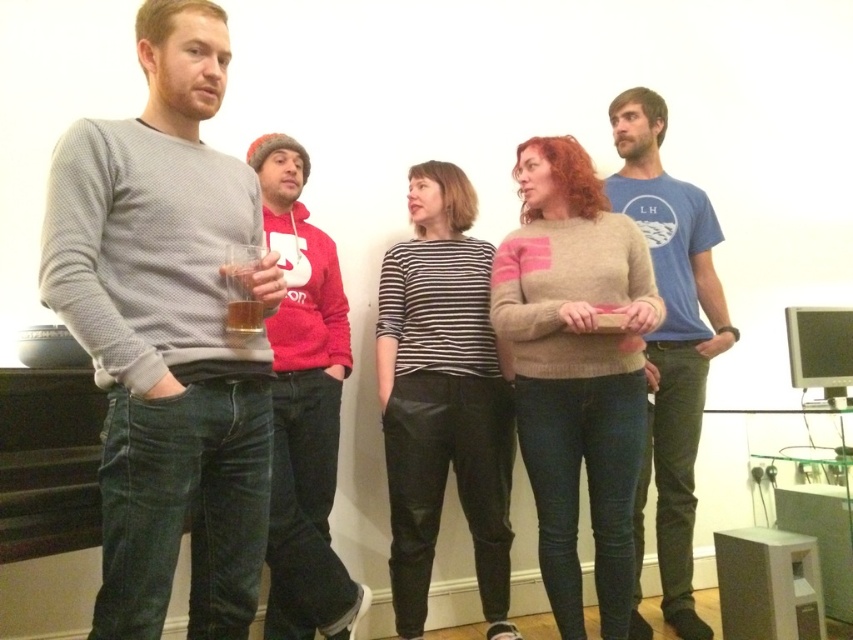
Based on the scene description, where is the matte red hoodie at center located in terms of its 2D coordinates?

The matte red hoodie at center is located at the 2D coordinates point (303,406).

Based on the scene description, which object is positioned higher between the black striped shirt at center and the translucent glass cup at left?

The translucent glass cup at left is positioned higher than the black striped shirt at center.

You are at a party and need to decide whether to place a large cake on the table. The table has space only for items smaller than the black striped shirt at center. Can the translucent glass cup at left fit on the table?

The translucent glass cup at left is smaller than the black striped shirt at center. Since the table can only hold items smaller than the black striped shirt at center, the translucent glass cup at left can fit on the table.